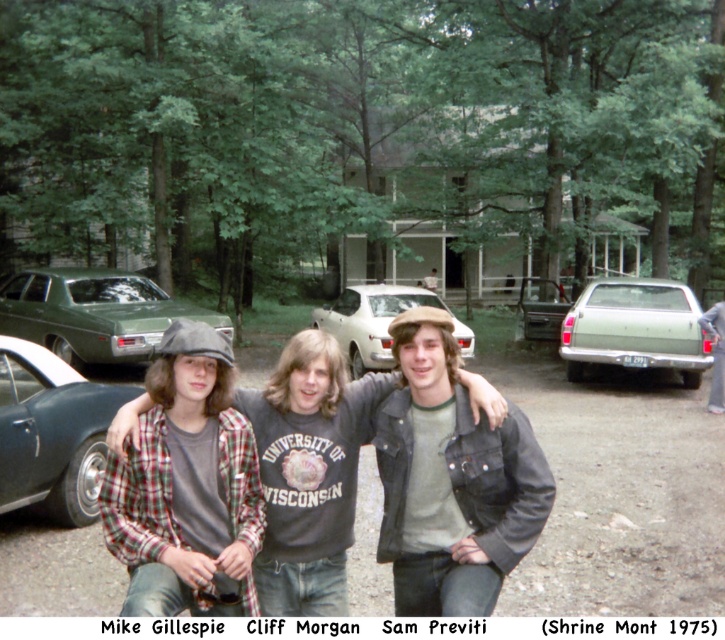
Question: Which point appears closest to the camera in this image?

Choices:
 (A) (413, 611)
 (B) (708, 314)
 (C) (291, 547)

Answer: (C)

Question: Does plaid shirt at center have a lesser width compared to shiny black car at left?

Choices:
 (A) no
 (B) yes

Answer: (B)

Question: Estimate the real-world distances between objects in this image. Which object is farther from the plaid flannel shirt at center?

Choices:
 (A) green matte sedan at left
 (B) green matte sedan at center
 (C) plaid shirt at center

Answer: (B)

Question: Does denim jacket at center have a smaller size compared to plaid shirt at center?

Choices:
 (A) no
 (B) yes

Answer: (A)

Question: Observing the image, what is the correct spatial positioning of green matte sedan at left in reference to light green matte sedan at right?

Choices:
 (A) above
 (B) below

Answer: (A)

Question: Which of the following is the closest to the observer?

Choices:
 (A) (566, 332)
 (B) (397, 406)
 (C) (306, 408)
 (D) (368, 316)

Answer: (B)